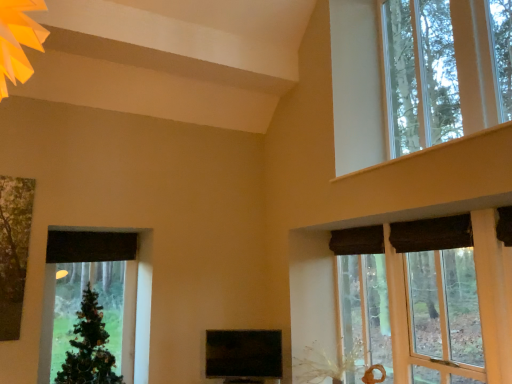
Question: From their relative heights in the image, would you say wooden window frame at upper right, which is counted as the 2th window, starting from the top, is taller or shorter than clear glass window at upper right, the first window when ordered from top to bottom?

Choices:
 (A) short
 (B) tall

Answer: (A)

Question: Is point (301, 286) closer or farther from the camera than point (422, 144)?

Choices:
 (A) closer
 (B) farther

Answer: (B)

Question: Which object is the closest to the matte black tv at center?

Choices:
 (A) wooden window frame at upper right, which ranks as the 1th window in bottom-to-top order
 (B) green matte christmas tree at left
 (C) clear glass window at upper right, placed as the 2th window when sorted from bottom to top

Answer: (A)

Question: Which object is the farthest from the clear glass window at upper right, placed as the 2th window when sorted from bottom to top?

Choices:
 (A) matte black tv at center
 (B) wooden window frame at upper right, which is counted as the 2th window, starting from the top
 (C) green matte christmas tree at left

Answer: (C)